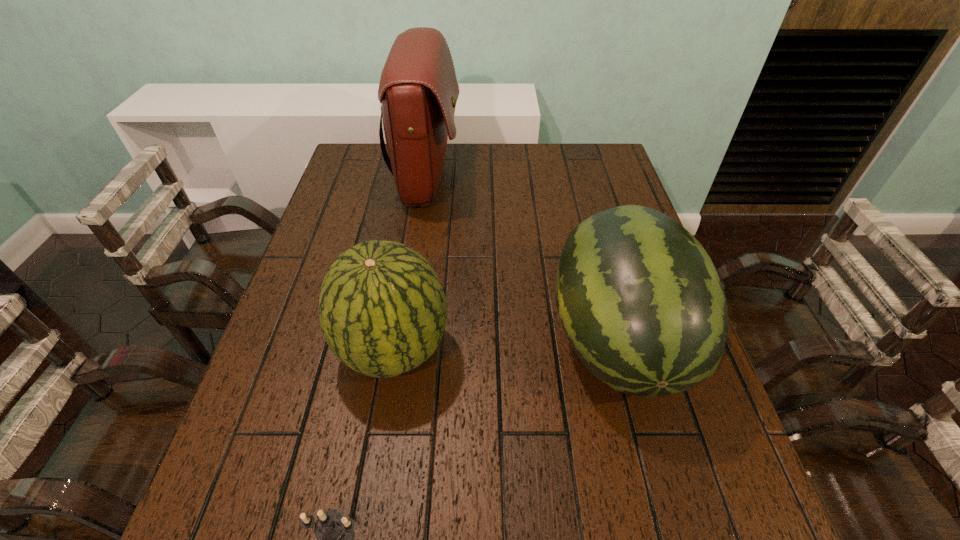
Image resolution: width=960 pixels, height=540 pixels. In order to click on the second closest object relative to the rightmost object in this screenshot , I will do `click(418, 90)`.

I want to click on the closest object to the rightmost object, so click(x=382, y=309).

Find the location of a particular element. vacant space that satisfies the following two spatial constraints: 1. on the open flap of the satchel; 2. on the back side of the rightmost object is located at coordinates (404, 340).

In order to click on free spot that satisfies the following two spatial constraints: 1. on the open flap of the farthest object; 2. on the right side of the rightmost object in this screenshot , I will do click(404, 340).

The width and height of the screenshot is (960, 540). Find the location of `free point that satisfies the following two spatial constraints: 1. on the open flap of the satchel; 2. on the left side of the right watermelon`. free point that satisfies the following two spatial constraints: 1. on the open flap of the satchel; 2. on the left side of the right watermelon is located at coordinates (404, 340).

Image resolution: width=960 pixels, height=540 pixels. Identify the location of vacant region that satisfies the following two spatial constraints: 1. on the open flap of the rightmost object; 2. on the right side of the satchel. point(404,340).

Locate an element on the screen. This screenshot has width=960, height=540. vacant space that satisfies the following two spatial constraints: 1. on the open flap of the tallest object; 2. on the left side of the right watermelon is located at coordinates (404, 340).

This screenshot has height=540, width=960. In order to click on blank area in the image that satisfies the following two spatial constraints: 1. on the open flap of the tallest object; 2. on the front side of the left watermelon in this screenshot , I will do `click(402, 350)`.

Where is `free spot that satisfies the following two spatial constraints: 1. on the open flap of the rightmost object; 2. on the left side of the satchel`? Image resolution: width=960 pixels, height=540 pixels. free spot that satisfies the following two spatial constraints: 1. on the open flap of the rightmost object; 2. on the left side of the satchel is located at coordinates (404, 340).

This screenshot has width=960, height=540. What are the coordinates of `vacant space that satisfies the following two spatial constraints: 1. on the open flap of the right watermelon; 2. on the left side of the tallest object` in the screenshot? It's located at (404, 340).